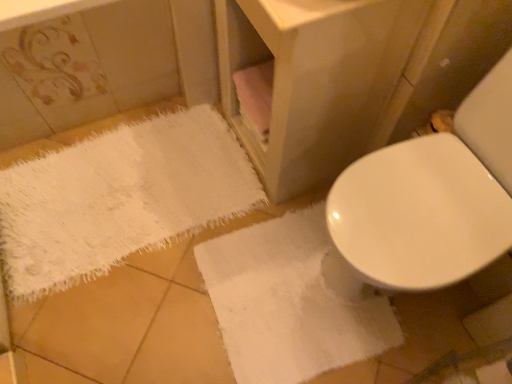
Identify the location of unoccupied area in front of white fluffy bath towel at lower left, the 2th bath towel when ordered from right to left. The image size is (512, 384). (124, 319).